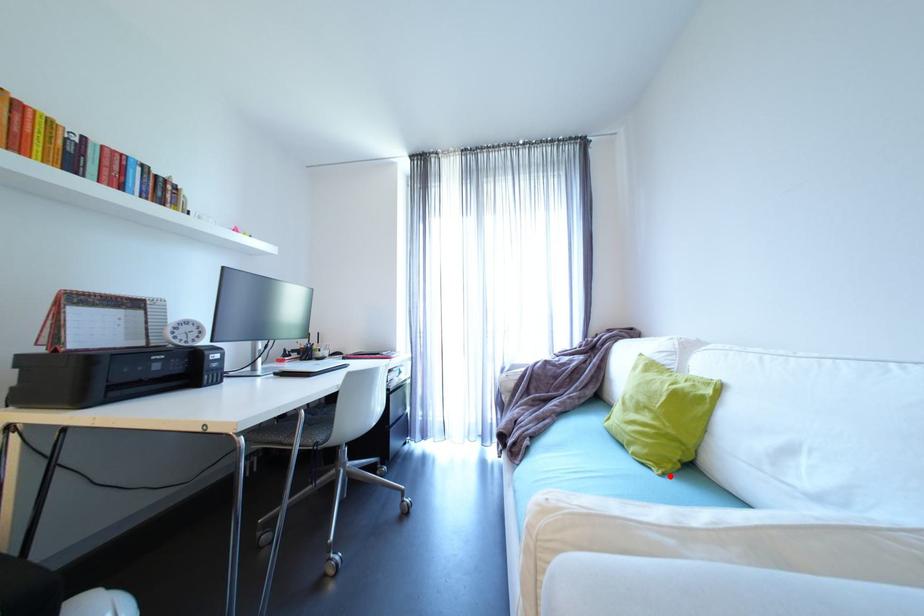
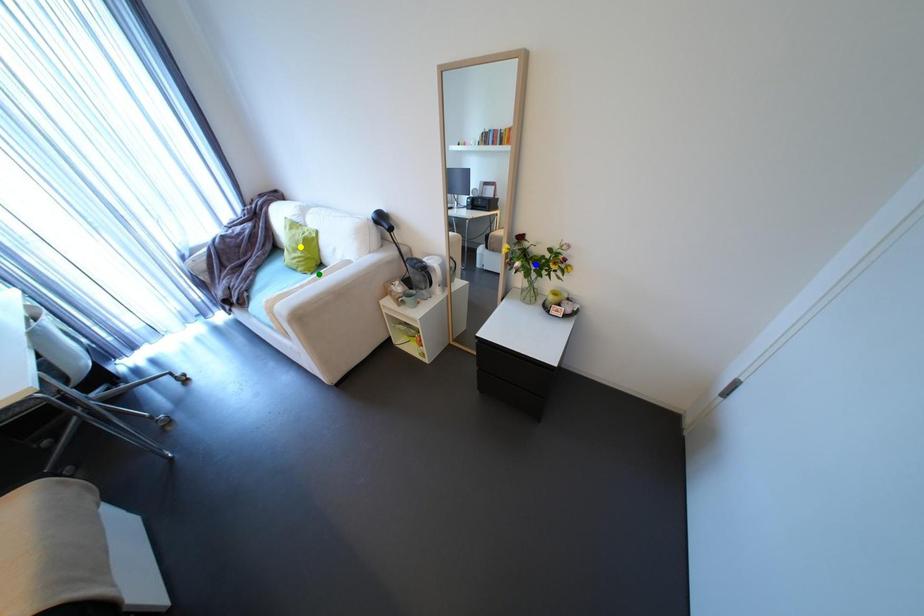
Question: I am providing you with two images of the same scene from different viewpoints. A red point is marked on the first image. You are given multiple points on the second image. Which mark in image 2 goes with the point in image 1?

Choices:
 (A) blue point
 (B) yellow point
 (C) green point

Answer: (C)